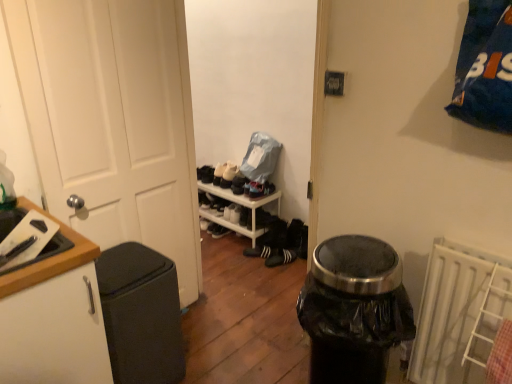
What do you see at coordinates (234, 214) in the screenshot?
I see `white suede shoe at center, the first shoe positioned from the bottom` at bounding box center [234, 214].

In order to face white suede shoe at center, the first shoe positioned from the bottom, should I rotate leftwards or rightwards?

You should look left and rotate roughly 2.155 degrees.

This screenshot has height=384, width=512. Identify the location of white matte door at left. (112, 120).

Measure the distance between point (105, 254) and camera.

Point (105, 254) is 1.88 meters away from camera.

The image size is (512, 384). Identify the location of white plastic shelf at center. (238, 204).

At what (x,y) coordinates should I click in order to perform the action: click on white plastic radiator at lower right. Please return your answer as a coordinate pair (x, y). This screenshot has width=512, height=384. Looking at the image, I should click on [459, 313].

Locate an element on the screen. black plastic trash can at center is located at coordinates (354, 310).

From a real-world perspective, is white matte cabinet at left positioned under white matte door at left based on gravity?

Correct, in the physical world, white matte cabinet at left is lower than white matte door at left.

Based on the photo, measure the distance from white matte cabinet at left to white matte door at left.

A distance of 24.40 inches exists between white matte cabinet at left and white matte door at left.

Is the surface of white matte cabinet at left in direct contact with white matte door at left?

No, white matte cabinet at left is not making contact with white matte door at left.

Between white matte cabinet at left and white matte door at left, which one appears on the right side from the viewer's perspective?

white matte door at left is more to the right.

From a real-world perspective, count 2nd footwears downward from the black matte trash can at left and point to it. Please provide its 2D coordinates.

[(280, 257)]

Is black matte trash can at left facing towards black suede sneakers at center, which is the 2th footwear in left-to-right order?

No, black matte trash can at left is not facing towards black suede sneakers at center, which is the 2th footwear in left-to-right order.

From the image's perspective, is black matte trash can at left under black suede sneakers at center, which is the 2th footwear in left-to-right order?

Indeed, from the image's perspective, black matte trash can at left is shown beneath black suede sneakers at center, which is the 2th footwear in left-to-right order.

Considering the positions of objects white suede shoe at center, the 3th shoe ordered from the bottom, and suede black shoe at center, which is the second shoe in bottom-to-top order, in the image provided, who is more to the left, white suede shoe at center, the 3th shoe ordered from the bottom, or suede black shoe at center, which is the second shoe in bottom-to-top order,?

From the viewer's perspective, white suede shoe at center, the 3th shoe ordered from the bottom, appears more on the left side.

Find the location of `shoe that is the 2nd object located in front of the white suede shoe at center, the 3th shoe ordered from the bottom`. shoe that is the 2nd object located in front of the white suede shoe at center, the 3th shoe ordered from the bottom is located at coordinates (228, 175).

From the image's perspective, is white suede shoe at center, which is the first shoe from top to bottom, above suede black shoe at center, which is the second shoe in bottom-to-top order?

Yes, from the image's perspective, white suede shoe at center, which is the first shoe from top to bottom, is above suede black shoe at center, which is the second shoe in bottom-to-top order.

Is suede black shoe at center, which is the second shoe in bottom-to-top order, surrounded by white suede shoe at center, the 3th shoe ordered from the bottom?

Definitely not — suede black shoe at center, which is the second shoe in bottom-to-top order, is not inside white suede shoe at center, the 3th shoe ordered from the bottom.

Considering the positions of points (124, 34) and (67, 258), is point (124, 34) farther from camera compared to point (67, 258)?

Yes, it is behind point (67, 258).

You are a GUI agent. You are given a task and a screenshot of the screen. Output one action in this format:
    pyautogui.click(x=<x>, y=<y>)
    Task: Click on the door above the white matte cabinet at left (from the image's perspective)
    This screenshot has height=384, width=512.
    Given the screenshot: What is the action you would take?
    pyautogui.click(x=112, y=120)

From a real-world perspective, does white matte door at left stand above white matte cabinet at left?

Yes, from a real-world perspective, white matte door at left is on top of white matte cabinet at left.

Who is taller, white matte door at left or white matte cabinet at left?

white matte door at left is taller.

Is point (121, 286) closer to camera compared to point (230, 211)?

Yes, point (121, 286) is in front of point (230, 211).

Are black matte trash can at left and white suede shoe at center, the first shoe positioned from the bottom, making contact?

There is a gap between black matte trash can at left and white suede shoe at center, the first shoe positioned from the bottom.

Is black matte trash can at left turned away from white suede shoe at center, the 3th shoe viewed from the top?

That's not correct — black matte trash can at left is not looking away from white suede shoe at center, the 3th shoe viewed from the top.

Is there a large distance between white suede shoe at center, the 3th shoe ordered from the bottom, and black suede sneakers at center, the first footwear from the right?

No, white suede shoe at center, the 3th shoe ordered from the bottom, is not far away from black suede sneakers at center, the first footwear from the right.

Considering their positions, is white suede shoe at center, the 3th shoe ordered from the bottom, located in front of or behind black suede sneakers at center, which is the 2th footwear in left-to-right order?

Clearly, white suede shoe at center, the 3th shoe ordered from the bottom, is behind black suede sneakers at center, which is the 2th footwear in left-to-right order.

Considering the positions of points (198, 177) and (266, 266), is point (198, 177) closer to camera compared to point (266, 266)?

No, it is behind (266, 266).

Which object is positioned more to the left, white plastic radiator at lower right or white matte sneakers at center, arranged as the first footwear when viewed from the left?

white matte sneakers at center, arranged as the first footwear when viewed from the left.

Considering the positions of point (431, 294) and point (265, 254), is point (431, 294) closer or farther from the camera than point (265, 254)?

Point (431, 294) appears to be closer to the viewer than point (265, 254).

From the image's perspective, would you say white plastic radiator at lower right is positioned over white matte sneakers at center, marked as the 2th footwear in a right-to-left arrangement?

No.

Is white plastic radiator at lower right inside or outside of white matte sneakers at center, marked as the 2th footwear in a right-to-left arrangement?

white plastic radiator at lower right is located beyond the bounds of white matte sneakers at center, marked as the 2th footwear in a right-to-left arrangement.

Identify the location of door behind the white matte cabinet at left. (112, 120).

There is a black matte trash can at left. Identify the location of the 1st footwear above it (from the image's perspective). This screenshot has height=384, width=512. (280, 257).

Based on their spatial positions, is suede black shoe at center, which is the 2th shoe in top-to-bottom order, or black matte trash can at left closer to white matte cabinet at left?

black matte trash can at left lies closer to white matte cabinet at left than the other object.

When comparing their distances from white plastic shelf at center, does wooden cutting board at left or white suede shoe at center, the 3th shoe ordered from the bottom, seem closer?

Based on the image, white suede shoe at center, the 3th shoe ordered from the bottom, appears to be nearer to white plastic shelf at center.

Which object lies further to the anchor point black plastic trash can at center, wooden cutting board at left or suede black shoe at center, which is the 2th shoe in top-to-bottom order?

Among the two, suede black shoe at center, which is the 2th shoe in top-to-bottom order, is located further to black plastic trash can at center.

Considering their positions, is black matte trash can at left positioned further to white matte cabinet at left than white suede shoe at center, the 3th shoe ordered from the bottom?

white suede shoe at center, the 3th shoe ordered from the bottom.

Which object lies further to the anchor point black matte trash can at left, white matte cabinet at left or white suede shoe at center, the 3th shoe ordered from the bottom?

The object further to black matte trash can at left is white suede shoe at center, the 3th shoe ordered from the bottom.

Considering their positions, is black suede sneakers at center, which is the 2th footwear in left-to-right order, positioned closer to white suede shoe at center, the 3th shoe ordered from the bottom, than white matte door at left?

Among the two, black suede sneakers at center, which is the 2th footwear in left-to-right order, is located nearer to white suede shoe at center, the 3th shoe ordered from the bottom.

From the image, which object appears to be nearer to suede black shoe at center, which is the second shoe in bottom-to-top order, white plastic shelf at center or black matte trash can at left?

white plastic shelf at center.

Considering their positions, is black plastic trash can at center positioned closer to white matte cabinet at left than white matte sneakers at center, marked as the 2th footwear in a right-to-left arrangement?

black plastic trash can at center.

Find the location of `countertop between white matte door at left and black matte trash can at left from top to bottom`. countertop between white matte door at left and black matte trash can at left from top to bottom is located at coordinates (x=49, y=258).

This screenshot has height=384, width=512. In order to click on shelf between black plastic trash can at center and white suede shoe at center, the first shoe positioned from the bottom, in the front-back direction in this screenshot , I will do `click(238, 204)`.

At what (x,y) coordinates should I click in order to perform the action: click on radiator between black plastic trash can at center and white suede shoe at center, the first shoe positioned from the bottom, along the z-axis. Please return your answer as a coordinate pair (x, y). This screenshot has height=384, width=512. Looking at the image, I should click on (459, 313).

The image size is (512, 384). I want to click on shelf between black matte trash can at left and suede black shoe at center, which is the second shoe in bottom-to-top order, in the front-back direction, so click(x=238, y=204).